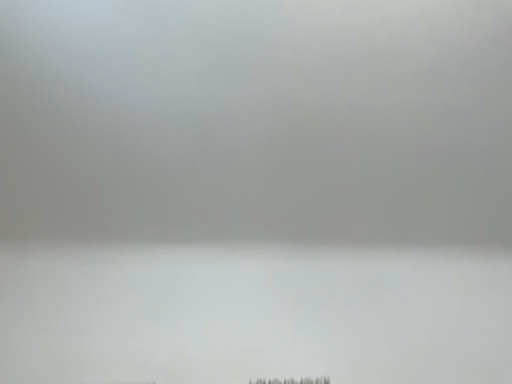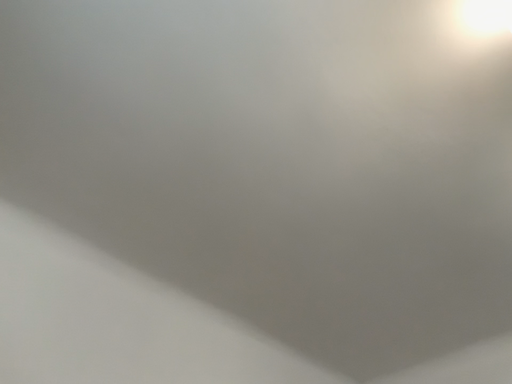
Question: Which way did the camera rotate in the video?

Choices:
 (A) rotated left
 (B) rotated right

Answer: (B)